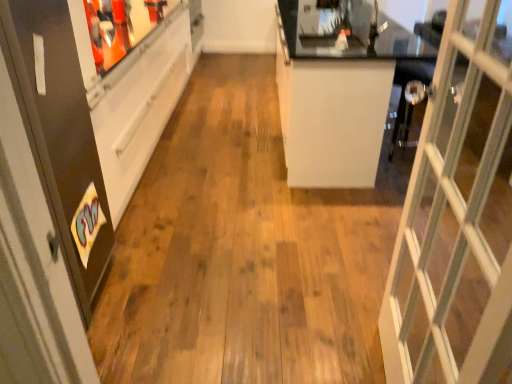
Question: Is matte black screen door at left at the back of white glossy counter at center?

Choices:
 (A) no
 (B) yes

Answer: (A)

Question: Is white glossy counter at center oriented towards matte black screen door at left?

Choices:
 (A) no
 (B) yes

Answer: (A)

Question: From a real-world perspective, is white glossy counter at center physically below matte black screen door at left?

Choices:
 (A) yes
 (B) no

Answer: (A)

Question: Is there a large distance between white glossy counter at center and matte black screen door at left?

Choices:
 (A) no
 (B) yes

Answer: (B)

Question: Does white glossy counter at center have a larger size compared to matte black screen door at left?

Choices:
 (A) yes
 (B) no

Answer: (A)

Question: Is white glossy counter at center thinner than matte black screen door at left?

Choices:
 (A) no
 (B) yes

Answer: (A)

Question: Considering the relative sizes of matte black screen door at left and white glossy counter at center in the image provided, is matte black screen door at left bigger than white glossy counter at center?

Choices:
 (A) no
 (B) yes

Answer: (A)

Question: Are matte black screen door at left and white glossy counter at center located far from each other?

Choices:
 (A) no
 (B) yes

Answer: (B)

Question: Is white glossy counter at center surrounded by matte black screen door at left?

Choices:
 (A) no
 (B) yes

Answer: (A)

Question: Does matte black screen door at left have a greater height compared to white glossy counter at center?

Choices:
 (A) yes
 (B) no

Answer: (A)

Question: From the image's perspective, does matte black screen door at left appear higher than white glossy counter at center?

Choices:
 (A) yes
 (B) no

Answer: (B)

Question: From a real-world perspective, is matte black screen door at left under white glossy counter at center?

Choices:
 (A) no
 (B) yes

Answer: (A)

Question: Is white glossy counter at center spatially inside matte black screen door at left, or outside of it?

Choices:
 (A) outside
 (B) inside

Answer: (A)